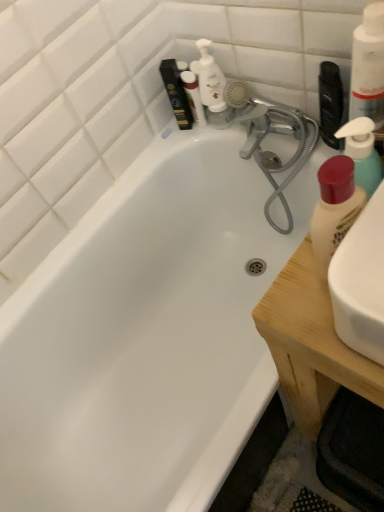
Question: From the image's perspective, is white pump bottle at upper right, which is the first cleaning product from top to bottom, below matte white lotion at right, which is the third cleaning product from top to bottom?

Choices:
 (A) no
 (B) yes

Answer: (A)

Question: Is white pump bottle at upper right, which is the first cleaning product from top to bottom, not within matte white lotion at right, which is the third cleaning product from top to bottom?

Choices:
 (A) yes
 (B) no

Answer: (A)

Question: Is white pump bottle at upper right, which is the first cleaning product from top to bottom, in contact with matte white lotion at right, which is the third cleaning product from top to bottom?

Choices:
 (A) yes
 (B) no

Answer: (B)

Question: Is white pump bottle at upper right, the 3th cleaning product from the bottom, wider than matte white lotion at right, which appears as the first cleaning product when ordered from the bottom?

Choices:
 (A) no
 (B) yes

Answer: (B)

Question: Considering the relative sizes of white pump bottle at upper right, which is the first cleaning product from top to bottom, and matte white lotion at right, which is the third cleaning product from top to bottom, in the image provided, is white pump bottle at upper right, which is the first cleaning product from top to bottom, bigger than matte white lotion at right, which is the third cleaning product from top to bottom,?

Choices:
 (A) no
 (B) yes

Answer: (B)

Question: Is white pump bottle at upper right, the 3th cleaning product from the bottom, taller than matte white lotion at right, which appears as the first cleaning product when ordered from the bottom?

Choices:
 (A) yes
 (B) no

Answer: (A)

Question: From the image's perspective, is matte white lotion at right, which is the third cleaning product from top to bottom, beneath white pump bottle at upper right, the 3th cleaning product from the bottom?

Choices:
 (A) yes
 (B) no

Answer: (A)

Question: Can you confirm if matte white lotion at right, which appears as the first cleaning product when ordered from the bottom, is wider than white pump bottle at upper right, which is the first cleaning product from top to bottom?

Choices:
 (A) no
 (B) yes

Answer: (A)

Question: Is white pump bottle at upper right, the 3th cleaning product from the bottom, inside matte white lotion at right, which is the third cleaning product from top to bottom?

Choices:
 (A) no
 (B) yes

Answer: (A)

Question: Does matte white lotion at right, which appears as the first cleaning product when ordered from the bottom, have a greater height compared to white pump bottle at upper right, the 3th cleaning product from the bottom?

Choices:
 (A) yes
 (B) no

Answer: (B)

Question: Does matte white lotion at right, which is the third cleaning product from top to bottom, turn towards white pump bottle at upper right, the 3th cleaning product from the bottom?

Choices:
 (A) yes
 (B) no

Answer: (B)

Question: Can you see matte white lotion at right, which is the third cleaning product from top to bottom, touching white pump bottle at upper right, the 3th cleaning product from the bottom?

Choices:
 (A) no
 (B) yes

Answer: (A)

Question: From the image's perspective, does wooden at right appear higher than white plastic pump bottle at upper center?

Choices:
 (A) no
 (B) yes

Answer: (A)